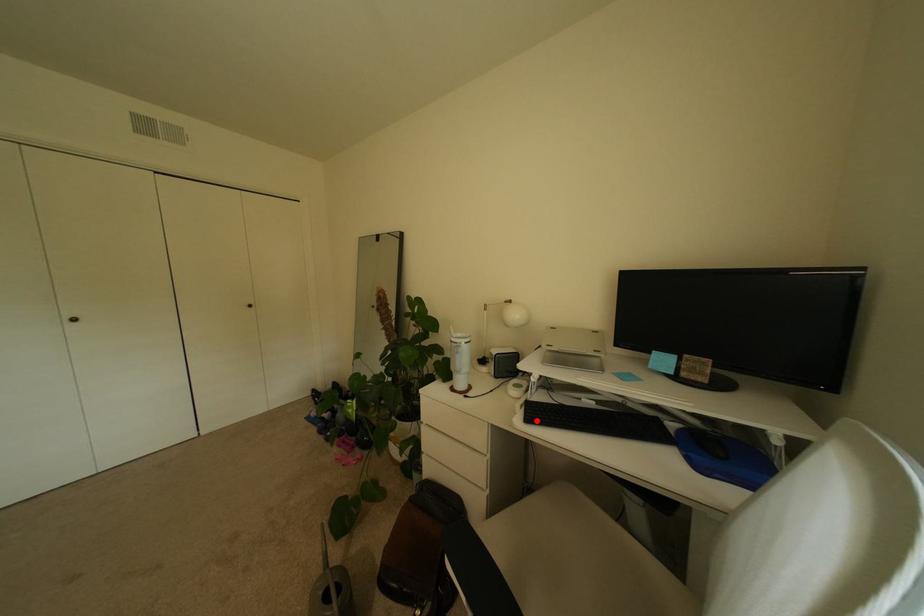
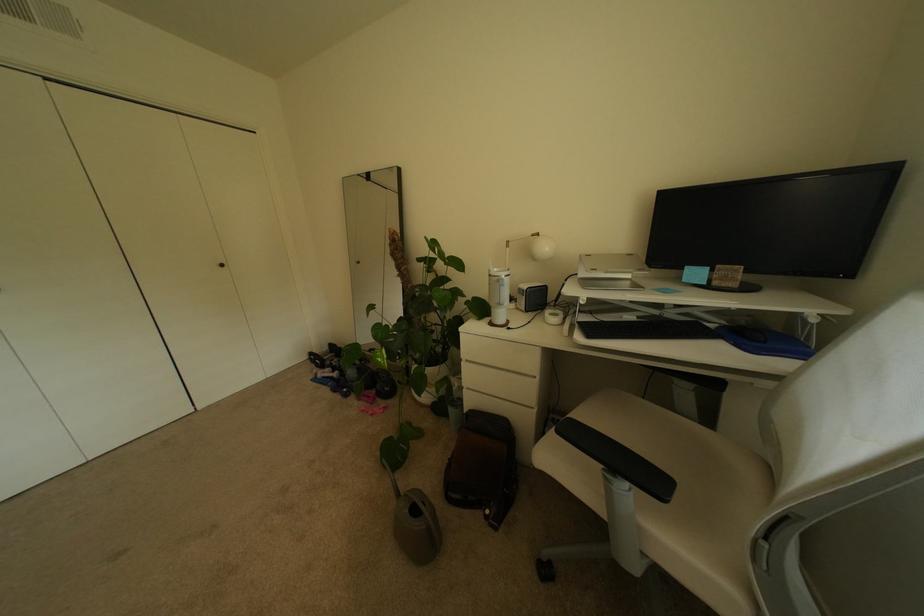
Where in the second image is the point corresponding to the highlighted location from the first image?

(598, 337)